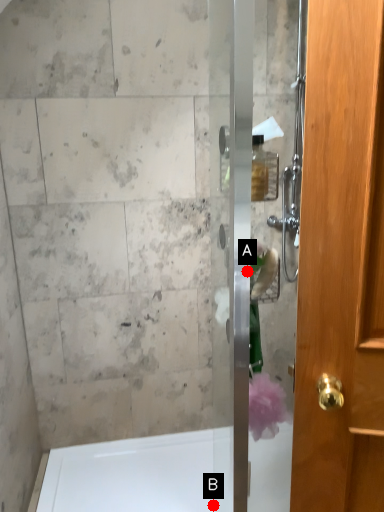
Question: Two points are circled on the image, labeled by A and B beside each circle. Which point is closer to the camera?

Choices:
 (A) A is closer
 (B) B is closer

Answer: (A)